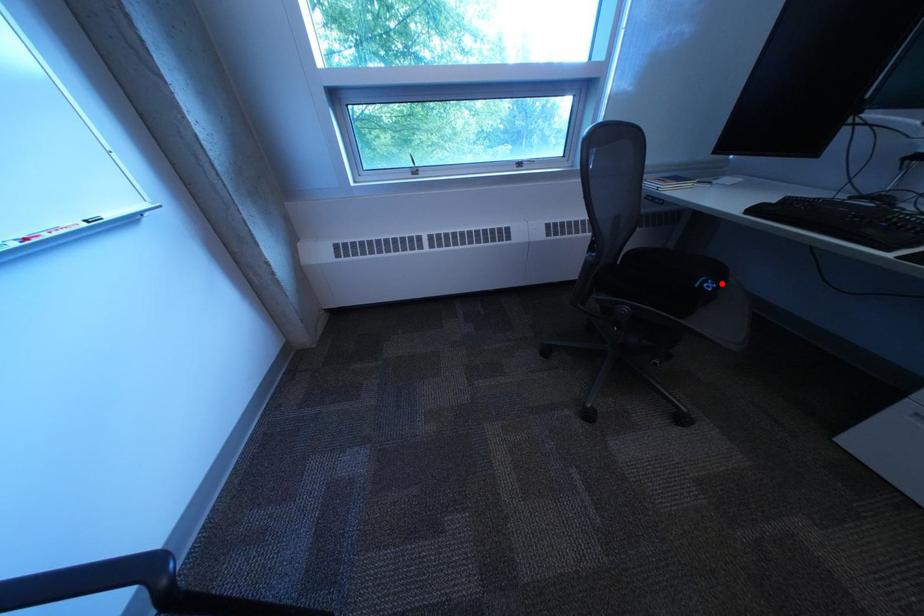
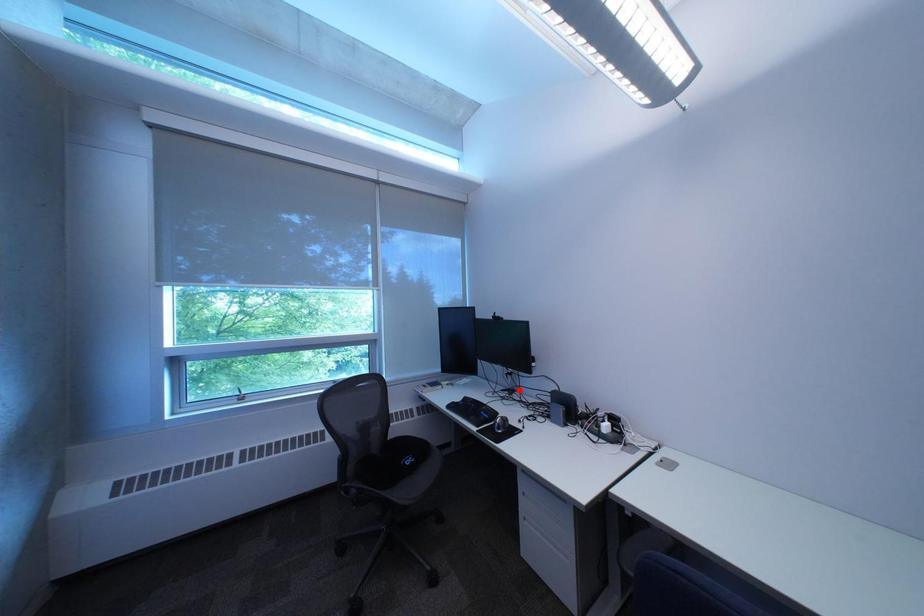
I am providing you with two images of the same scene from different viewpoints. A red point is marked on the first image and another point is marked on the second image. Do the highlighted points in image1 and image2 indicate the same real-world spot?

No